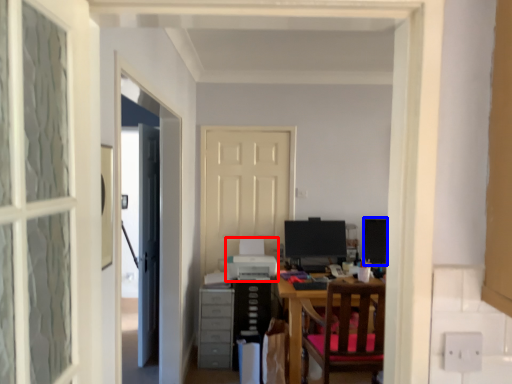
Question: Among these objects, which one is nearest to the camera, printer (highlighted by a red box) or computer monitor (highlighted by a blue box)?

Choices:
 (A) printer
 (B) computer monitor

Answer: (A)